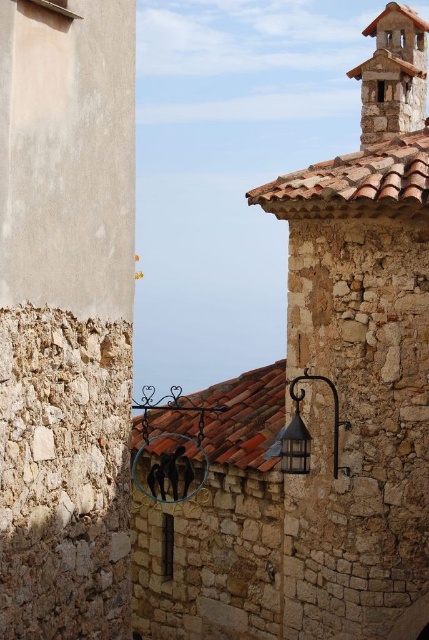
Is brown tile roof at center above stone bell tower at upper right?

Incorrect, brown tile roof at center is not positioned above stone bell tower at upper right.

Does brown tile roof at center have a smaller size compared to stone bell tower at upper right?

Actually, brown tile roof at center might be larger than stone bell tower at upper right.

Find the location of a particular element. The width and height of the screenshot is (429, 640). brown tile roof at center is located at coordinates (244, 417).

Is brown clay tiles at upper right positioned before matte black lantern at center?

Yes, brown clay tiles at upper right is closer to the viewer.

Does brown clay tiles at upper right appear on the left side of matte black lantern at center?

No, brown clay tiles at upper right is not to the left of matte black lantern at center.

Between point (304, 202) and point (289, 465), which one is positioned in front?

Positioned in front is point (289, 465).

Locate an element on the screen. The image size is (429, 640). brown clay tiles at upper right is located at coordinates (355, 182).

What do you see at coordinates (392, 76) in the screenshot? I see `stone bell tower at upper right` at bounding box center [392, 76].

This screenshot has width=429, height=640. Identify the location of stone bell tower at upper right. (392, 76).

Locate an element on the screen. This screenshot has width=429, height=640. stone bell tower at upper right is located at coordinates (392, 76).